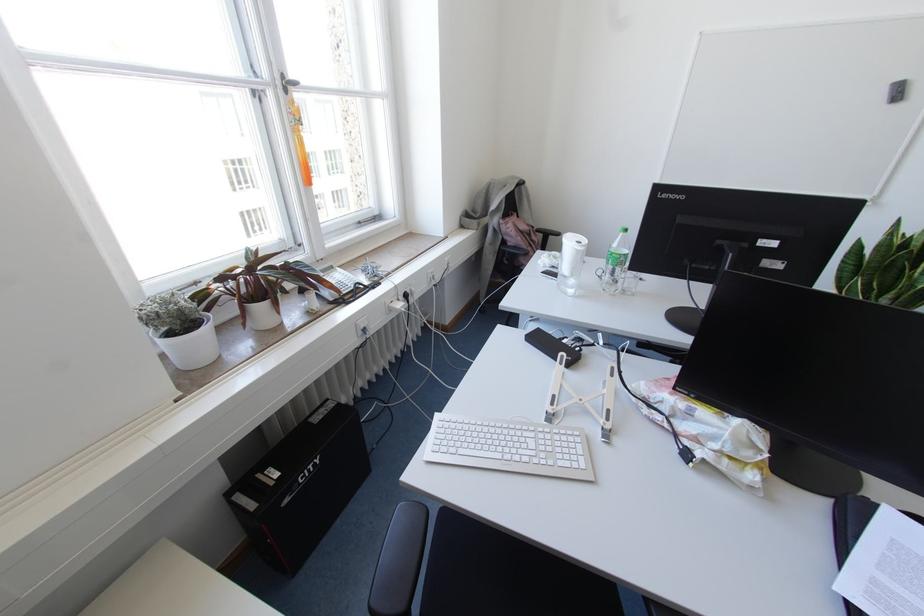
Where would you lift the telephone handset? Please return your answer as a coordinate pair (x, y).

(335, 276)